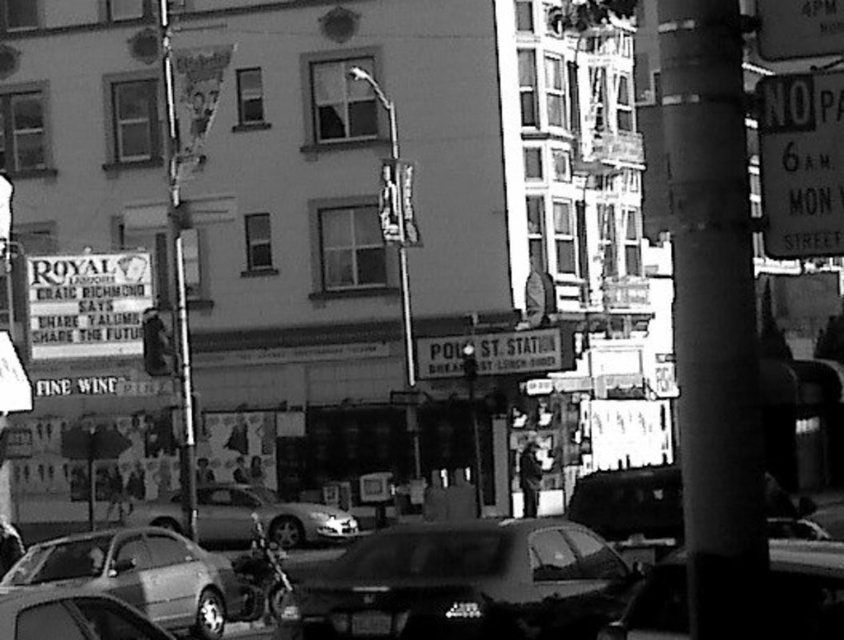
Question: Which object is the farthest from the shiny black sedan at center?

Choices:
 (A) metallic rectangular sign at upper right
 (B) white paper sign at left
 (C) metallic silver car at center
 (D) metallic silver car at lower left

Answer: (B)

Question: Can you confirm if shiny black sedan at center is smaller than metallic rectangular sign at upper right?

Choices:
 (A) no
 (B) yes

Answer: (A)

Question: Does metallic rectangular sign at upper right have a larger size compared to white paper sign at left?

Choices:
 (A) yes
 (B) no

Answer: (B)

Question: Which point is closer to the camera?

Choices:
 (A) metallic silver car at center
 (B) metallic traffic light at center
 (C) metallic rectangular sign at upper right
 (D) metallic silver car at lower left

Answer: (A)

Question: Which point appears closest to the camera in this image?

Choices:
 (A) (208, 490)
 (B) (46, 618)
 (C) (722, 3)

Answer: (C)

Question: Does metallic silver car at lower left appear on the right side of white paper sign at left?

Choices:
 (A) yes
 (B) no

Answer: (A)